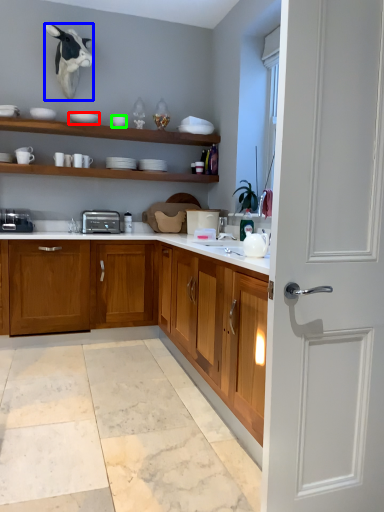
Question: Considering the real-world distances, which object is farthest from tableware (highlighted by a red box)? animal (highlighted by a blue box) or tableware (highlighted by a green box)?

Choices:
 (A) animal
 (B) tableware

Answer: (A)